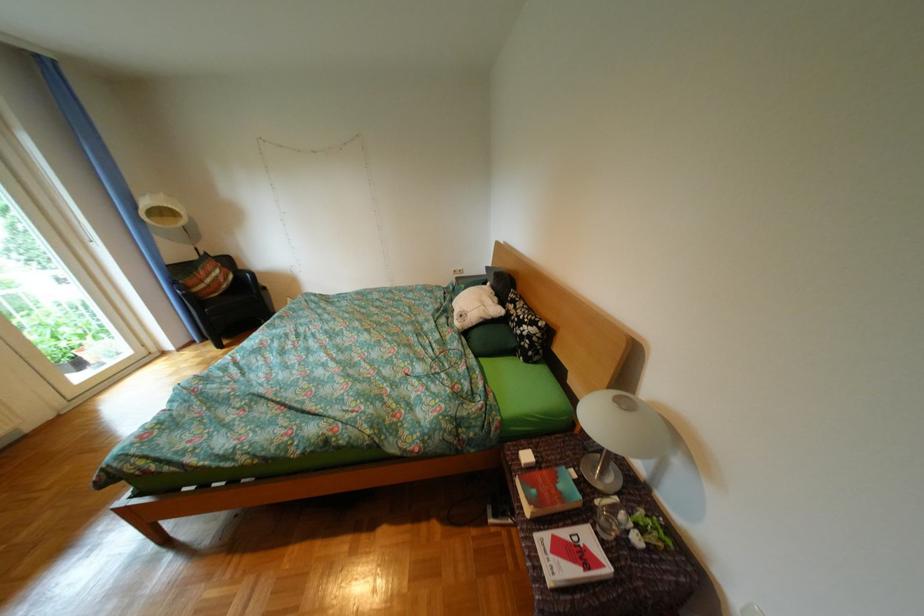
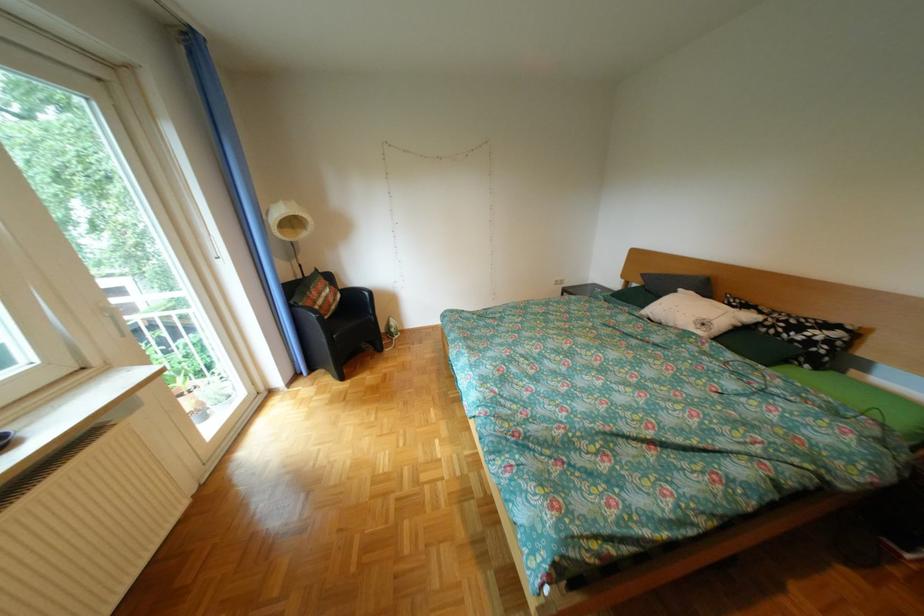
Find the pixel in the second image that matches point 529,309 in the first image.

(775, 313)